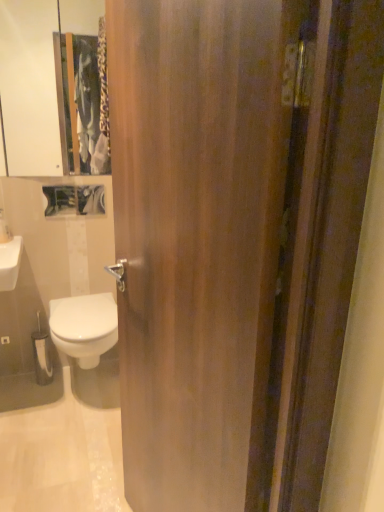
Question: Is white glossy bidet at lower left located within white glossy soap dispenser at upper left?

Choices:
 (A) no
 (B) yes

Answer: (A)

Question: Would you say white glossy soap dispenser at upper left is a long distance from white glossy bidet at lower left?

Choices:
 (A) yes
 (B) no

Answer: (B)

Question: Is white glossy soap dispenser at upper left further to the viewer compared to white glossy bidet at lower left?

Choices:
 (A) no
 (B) yes

Answer: (B)

Question: Is white glossy soap dispenser at upper left positioned with its back to white glossy bidet at lower left?

Choices:
 (A) no
 (B) yes

Answer: (A)

Question: Could you tell me if white glossy soap dispenser at upper left is facing white glossy bidet at lower left?

Choices:
 (A) yes
 (B) no

Answer: (B)

Question: Considering the relative positions of white glossy soap dispenser at upper left and white glossy bidet at lower left in the image provided, is white glossy soap dispenser at upper left to the left of white glossy bidet at lower left from the viewer's perspective?

Choices:
 (A) no
 (B) yes

Answer: (B)

Question: Considering the relative sizes of white glossy bidet at lower left and wooden door at center in the image provided, is white glossy bidet at lower left taller than wooden door at center?

Choices:
 (A) no
 (B) yes

Answer: (A)

Question: Is white glossy bidet at lower left positioned beyond the bounds of wooden door at center?

Choices:
 (A) no
 (B) yes

Answer: (B)

Question: Considering the relative sizes of white glossy bidet at lower left and wooden door at center in the image provided, is white glossy bidet at lower left shorter than wooden door at center?

Choices:
 (A) no
 (B) yes

Answer: (B)

Question: Does white glossy bidet at lower left appear on the left side of wooden door at center?

Choices:
 (A) no
 (B) yes

Answer: (B)

Question: Considering the relative positions of white glossy bidet at lower left and wooden door at center in the image provided, is white glossy bidet at lower left to the right of wooden door at center from the viewer's perspective?

Choices:
 (A) yes
 (B) no

Answer: (B)

Question: Does white glossy bidet at lower left have a greater width compared to wooden door at center?

Choices:
 (A) no
 (B) yes

Answer: (B)

Question: Would you say white glossy soap dispenser at upper left is outside white glossy medicine cabinet at upper left?

Choices:
 (A) no
 (B) yes

Answer: (B)